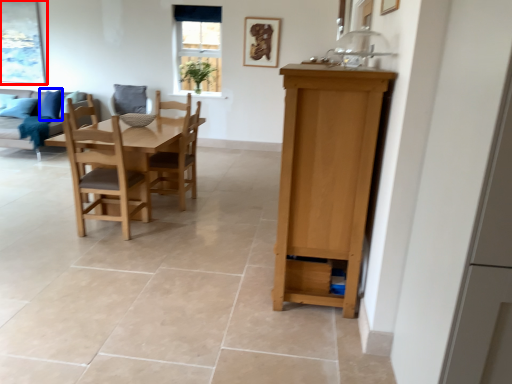
Question: Which of the following is the farthest to the observer, picture frame (highlighted by a red box) or pillow (highlighted by a blue box)?

Choices:
 (A) picture frame
 (B) pillow

Answer: (A)